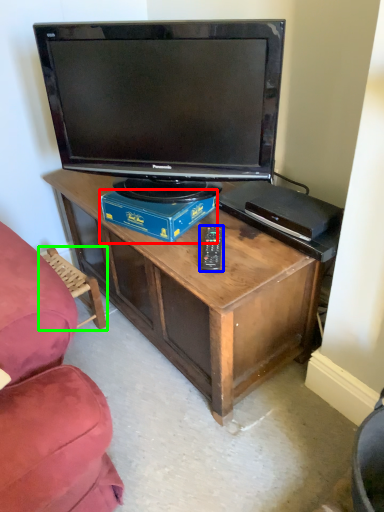
Question: Considering the real-world distances, which object is farthest from box (highlighted by a red box)? remote (highlighted by a blue box) or swivel chair (highlighted by a green box)?

Choices:
 (A) remote
 (B) swivel chair

Answer: (B)